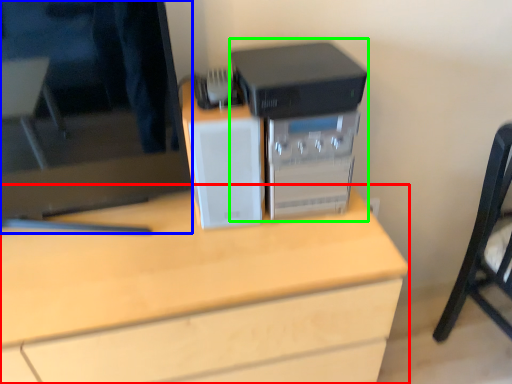
Question: Which is farther away from desk (highlighted by a red box)? computer monitor (highlighted by a blue box) or home appliance (highlighted by a green box)?

Choices:
 (A) computer monitor
 (B) home appliance

Answer: (B)